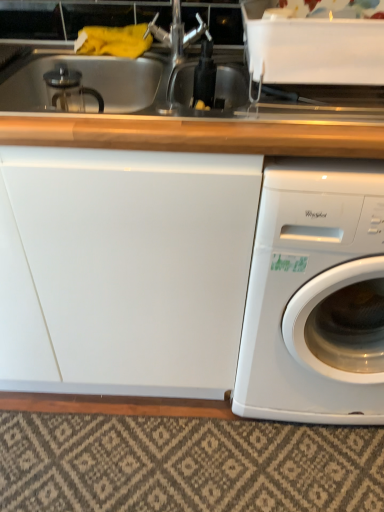
Image resolution: width=384 pixels, height=512 pixels. What are the coordinates of `white glossy washing machine at right` in the screenshot? It's located at (316, 296).

What do you see at coordinates (316, 296) in the screenshot?
I see `white glossy washing machine at right` at bounding box center [316, 296].

Measure the distance between white glossy washing machine at right and camera.

white glossy washing machine at right is 30.76 inches from camera.

Where is `white glossy washing machine at right`? This screenshot has width=384, height=512. white glossy washing machine at right is located at coordinates (316, 296).